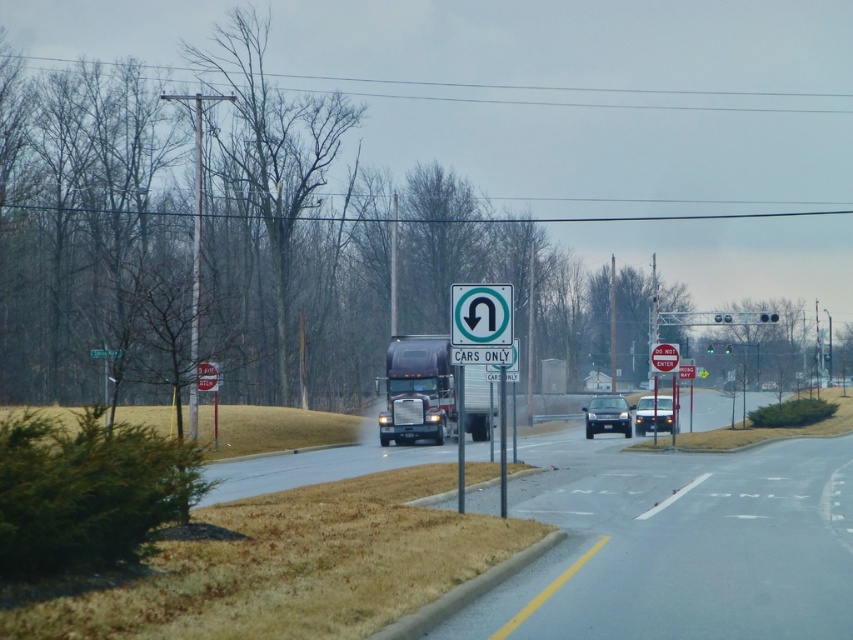
Which is above, metallic silver trailer truck at center or green plastic sign at center?

Positioned higher is green plastic sign at center.

Between metallic silver trailer truck at center and green plastic sign at center, which one has more height?

metallic silver trailer truck at center

Which is behind, point (440, 412) or point (508, 312)?

Point (440, 412)

At what (x,y) coordinates should I click in order to perform the action: click on metallic silver trailer truck at center. Please return your answer as a coordinate pair (x, y). This screenshot has height=640, width=853. Looking at the image, I should click on (416, 388).

Can you confirm if matte black sedan at center is positioned above shiny black sedan at center?

No, matte black sedan at center is not above shiny black sedan at center.

Who is taller, matte black sedan at center or shiny black sedan at center?

Standing taller between the two is shiny black sedan at center.

Does point (630, 432) lie behind point (650, 426)?

No, (630, 432) is in front of (650, 426).

Where is `matte black sedan at center`? The height and width of the screenshot is (640, 853). matte black sedan at center is located at coordinates (607, 416).

Which is above, metallic silver trailer truck at center or shiny black sedan at center?

metallic silver trailer truck at center is higher up.

Which is in front, point (415, 380) or point (648, 413)?

Positioned in front is point (415, 380).

Describe the element at coordinates (416, 388) in the screenshot. This screenshot has height=640, width=853. I see `metallic silver trailer truck at center` at that location.

The image size is (853, 640). Find the location of `metallic silver trailer truck at center`. metallic silver trailer truck at center is located at coordinates pos(416,388).